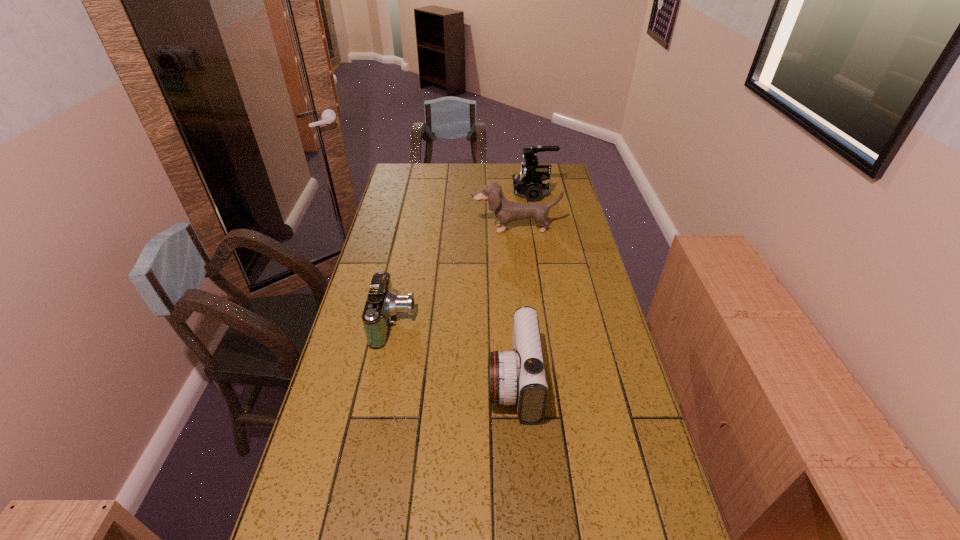
This screenshot has width=960, height=540. I want to click on vacant point located between the tallest camcorder and the second tallest camcorder, so click(523, 287).

Where is `free spot between the second shortest camcorder and the third nearest object`? free spot between the second shortest camcorder and the third nearest object is located at coordinates (515, 305).

Where is `vacant space that is in between the shortest object and the second tallest camcorder`? The height and width of the screenshot is (540, 960). vacant space that is in between the shortest object and the second tallest camcorder is located at coordinates (454, 352).

Image resolution: width=960 pixels, height=540 pixels. In order to click on object that stands as the third closest to the second tallest camcorder in this screenshot , I will do `click(532, 183)`.

Identify which object is the closest to the tallest camcorder. Please provide its 2D coordinates. Your answer should be formatted as a tuple, i.e. [(x, y)], where the tuple contains the x and y coordinates of a point satisfying the conditions above.

[(506, 211)]

Point out which camcorder is positioned as the second nearest to the second tallest camcorder. Please provide its 2D coordinates. Your answer should be formatted as a tuple, i.e. [(x, y)], where the tuple contains the x and y coordinates of a point satisfying the conditions above.

[(532, 183)]

The image size is (960, 540). Identify the location of camcorder that is the closest to the farthest camcorder. tap(382, 303).

In order to click on vacant area that satisfies the following two spatial constraints: 1. at the face of the puppy; 2. on the surface of the second shortest camcorder in this screenshot , I will do `click(531, 381)`.

Identify the location of free location that satisfies the following two spatial constraints: 1. at the face of the second farthest object; 2. on the front-facing side of the leftmost camcorder. (525, 322).

Where is `vacant area that satisfies the following two spatial constraints: 1. at the face of the puppy; 2. on the front-facing side of the leftmost camcorder`? The width and height of the screenshot is (960, 540). vacant area that satisfies the following two spatial constraints: 1. at the face of the puppy; 2. on the front-facing side of the leftmost camcorder is located at coordinates (525, 322).